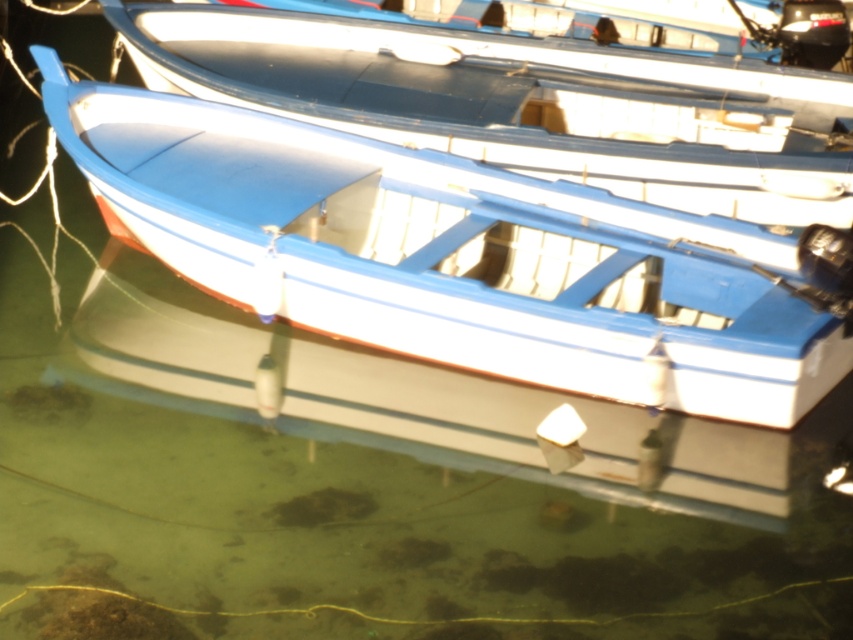
Question: Can you confirm if matte blue canoe at center is positioned to the right of blue matte boat at center?

Choices:
 (A) yes
 (B) no

Answer: (B)

Question: Which point is farther to the camera?

Choices:
 (A) (811, 384)
 (B) (846, 173)

Answer: (B)

Question: Does matte blue canoe at center appear on the left side of blue matte boat at center?

Choices:
 (A) no
 (B) yes

Answer: (B)

Question: Where is matte blue canoe at center located in relation to blue matte boat at center in the image?

Choices:
 (A) left
 (B) right

Answer: (A)